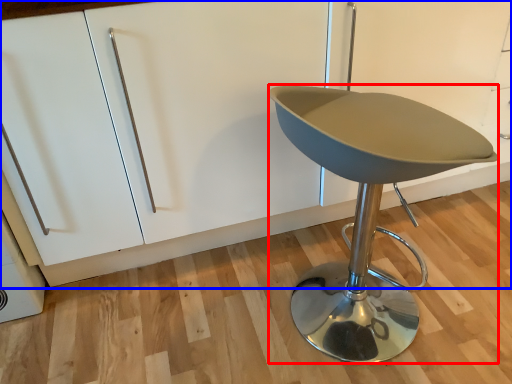
Question: Which object is closer to the camera taking this photo, furniture (highlighted by a red box) or cabinetry (highlighted by a blue box)?

Choices:
 (A) furniture
 (B) cabinetry

Answer: (A)